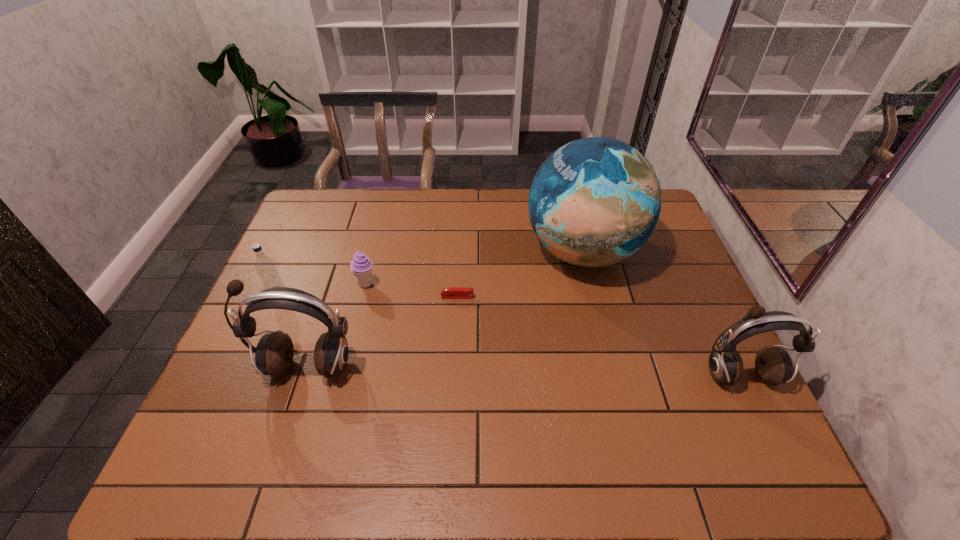
Locate an element on the screen. free spot between the shortest object and the fourth shortest object is located at coordinates (598, 336).

Identify the location of free spot between the tallest object and the second shortest object. The height and width of the screenshot is (540, 960). (474, 268).

Locate an element on the screen. The image size is (960, 540). free point between the icecream and the third shortest object is located at coordinates (323, 289).

Identify the location of vacant area that lies between the fourth tallest object and the second shortest object. This screenshot has width=960, height=540. (323, 289).

The image size is (960, 540). Find the location of `free space between the taller earphone and the water bottle`. free space between the taller earphone and the water bottle is located at coordinates (293, 331).

Find the location of `unoccupied position between the fifth tallest object and the shorter earphone`. unoccupied position between the fifth tallest object and the shorter earphone is located at coordinates (553, 330).

Identify the location of empty space that is in between the shorter earphone and the second tallest object. (523, 372).

Identify the location of unoccupied area between the fifth tallest object and the water bottle. This screenshot has height=540, width=960. (323, 289).

The image size is (960, 540). Find the location of `object that stands as the third closest to the water bottle`. object that stands as the third closest to the water bottle is located at coordinates (452, 292).

Select which object is the second closest to the taller earphone. Please provide its 2D coordinates. Your answer should be formatted as a tuple, i.e. [(x, y)], where the tuple contains the x and y coordinates of a point satisfying the conditions above.

[(361, 266)]